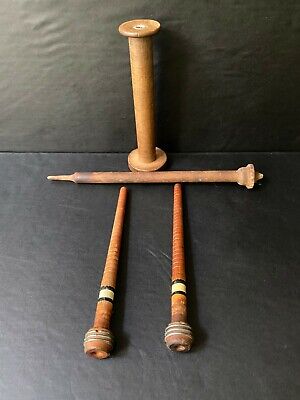
Identify the location of table. (239, 300).